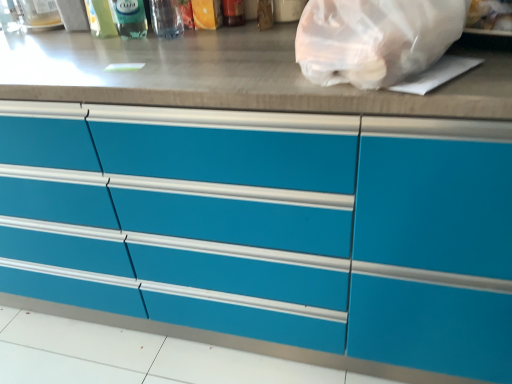
You are a GUI agent. You are given a task and a screenshot of the screen. Output one action in this format:
    pyautogui.click(x=<x>, y=<y>)
    Task: Click on the free location to the right of transparent plastic bottle at upper left, which is the 2th bottle in left-to-right order
    The image size is (512, 384).
    Given the screenshot: What is the action you would take?
    pyautogui.click(x=195, y=37)